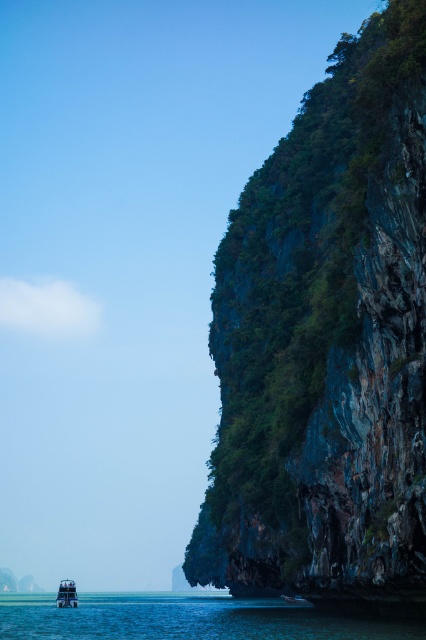
You are standing on the beach in this coastal scene. You want to walk from the metallic silver boat at lower left to the green rock cliff at right. Which direction should you head towards?

You should head towards the right direction because the green rock cliff at right is closer to the viewer than the metallic silver boat at lower left, so moving right would lead you towards the cliff.

In the scene shown: You are a photographer planning to capture the green rock cliff at right and the metallic silver boat at lower left in the same frame. Based on their positions, which object would appear closer to the top of your photo?

The green rock cliff at right is above the metallic silver boat at lower left, so it would appear closer to the top of the photo.

You are a photographer planning to capture the green rock cliff at right and the metallic silver boat at lower left in a single frame. Based on their sizes in the image, which object should you focus on first if you want both to be clearly visible in your photo?

The green rock cliff at right has a smaller size compared to the metallic silver boat at lower left. To ensure both are clearly visible, focus on the metallic silver boat at lower left first since it is larger and might require more detailed attention.